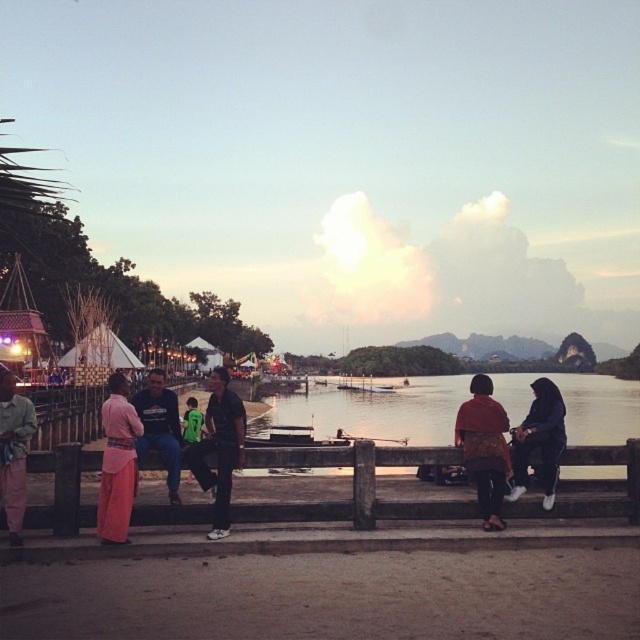
Does point (140, 420) come closer to viewer compared to point (228, 449)?

Yes, point (140, 420) is closer to viewer.

Does pink fabric pants at lower left appear over black matte jacket at center?

No, pink fabric pants at lower left is not above black matte jacket at center.

Measure the distance between point (x=125, y=493) and camera.

8.57 meters

The width and height of the screenshot is (640, 640). I want to click on pink fabric pants at lower left, so click(116, 461).

Does point (227, 518) lie in front of point (170, 452)?

Yes.

Is black matte jacket at center wider than dark blue jeans at center?

In fact, black matte jacket at center might be narrower than dark blue jeans at center.

Who is more forward, (216, 381) or (160, 440)?

Point (216, 381) is in front.

Locate an element on the screen. The height and width of the screenshot is (640, 640). black matte jacket at center is located at coordinates (221, 445).

Based on the photo, is black matte jacket at center to the right of green jersey at center from the viewer's perspective?

Yes, black matte jacket at center is to the right of green jersey at center.

Is point (236, 458) less distant than point (192, 476)?

That is True.

Identify the location of black matte jacket at center. (221, 445).